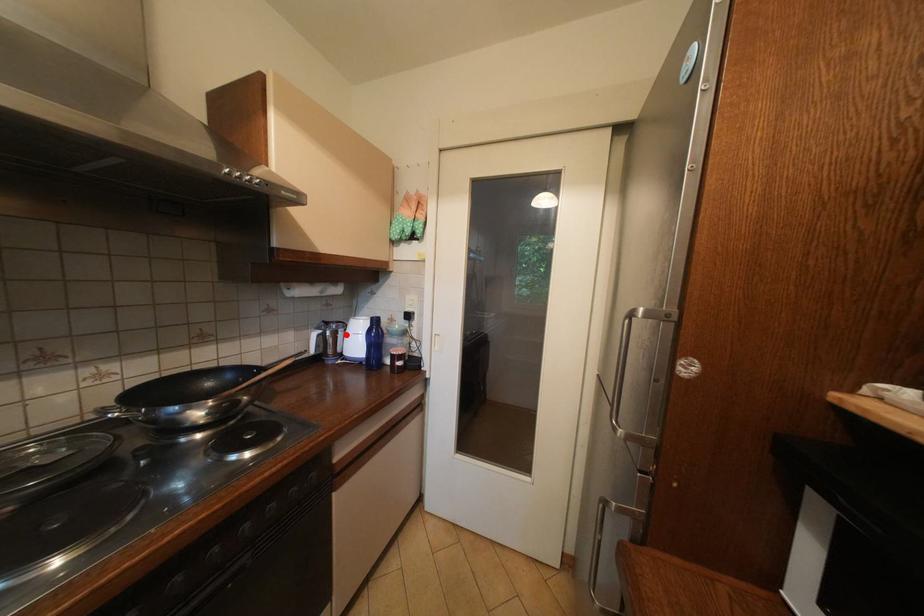
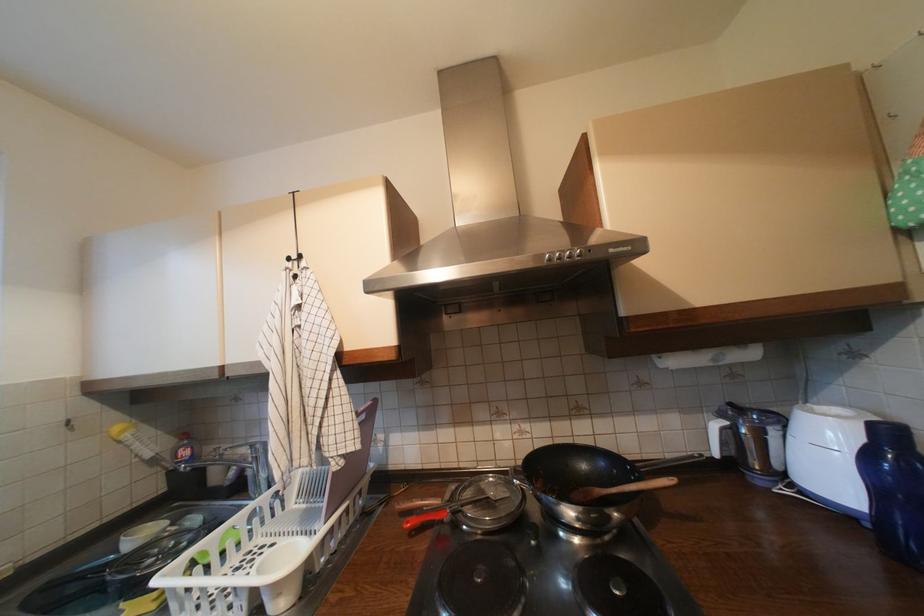
Where in the second image is the point corresponding to the highlighted location from the first image?

(774, 435)